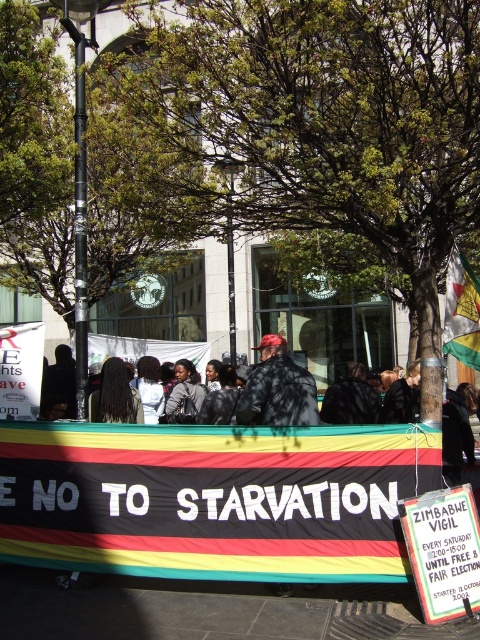
Based on the scene description, where is the matte black jacket at center located in the image?

The matte black jacket at center is located at point coordinates of (277,388).

You are a photographer trying to capture a clear shot of the matte black jacket at center and the long black hair at center. Which object should you focus on first to ensure both are in frame without adjusting your camera angle?

The matte black jacket at center is taller than the long black hair at center, so you should focus on the matte black jacket at center first to ensure both are in frame without adjusting your camera angle.